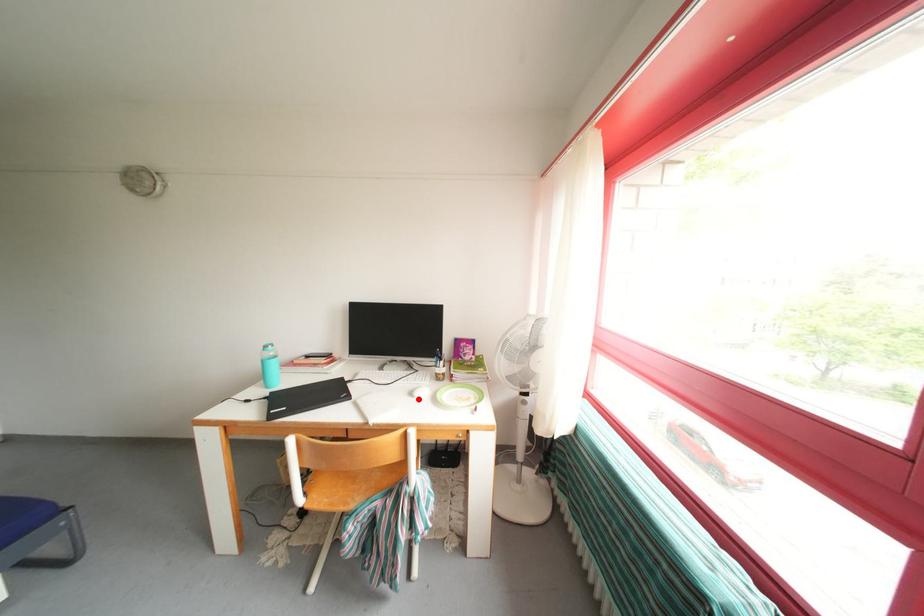
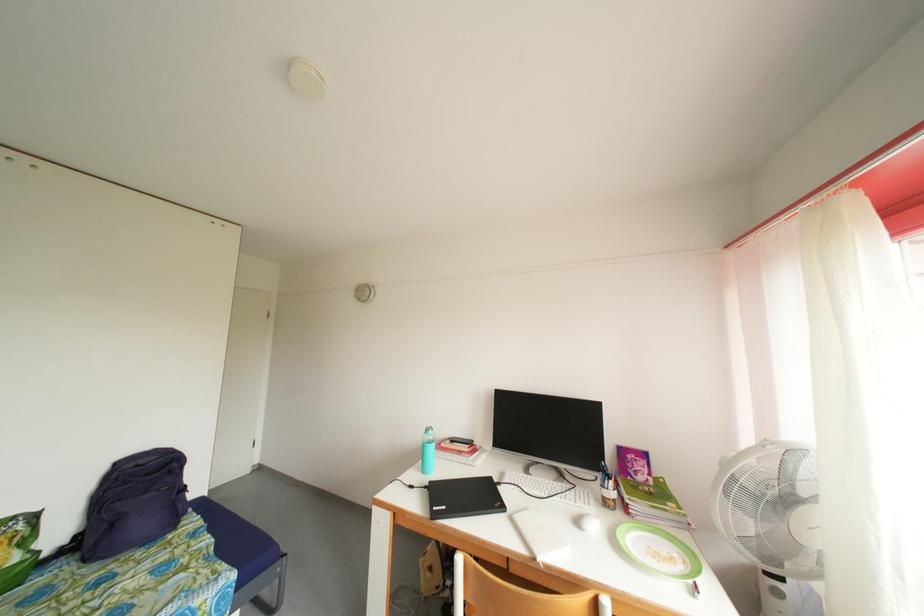
Where in the second image is the point corresponding to the highlighted location from the first image?

(585, 528)